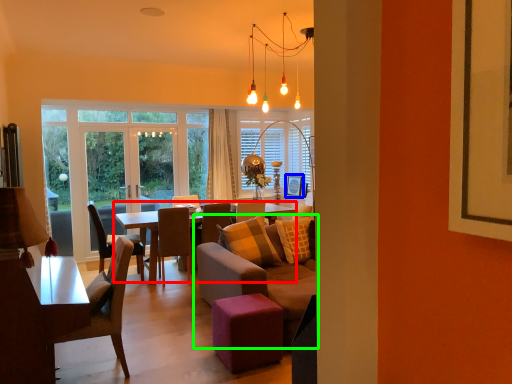
Question: Which object is positioned farthest from coffee table (highlighted by a red box)? Select from picture frame (highlighted by a blue box) and studio couch (highlighted by a green box).

Choices:
 (A) picture frame
 (B) studio couch

Answer: (A)